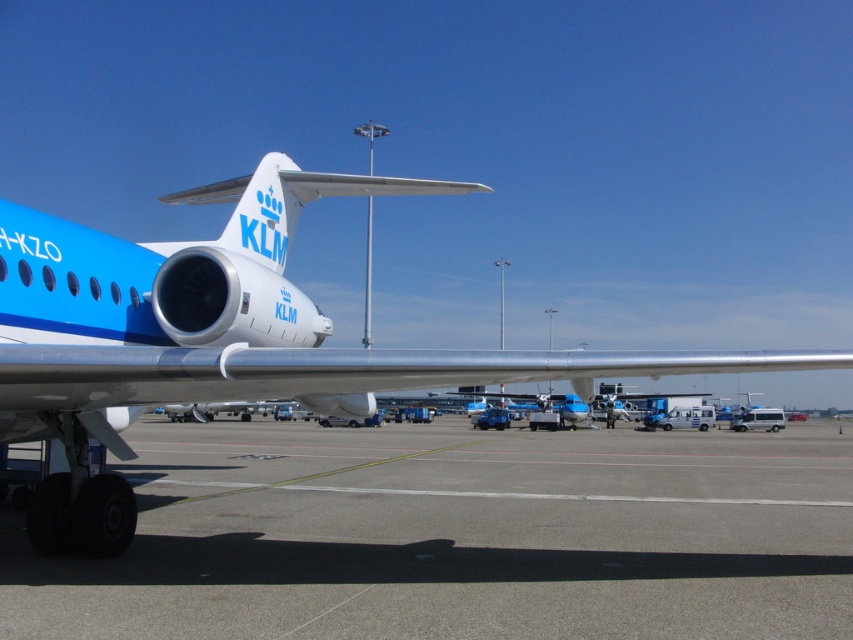
Can you confirm if gray concrete runway at center is positioned above matte blue airplane at center?

Actually, gray concrete runway at center is below matte blue airplane at center.

Can you confirm if gray concrete runway at center is thinner than matte blue airplane at center?

In fact, gray concrete runway at center might be wider than matte blue airplane at center.

The width and height of the screenshot is (853, 640). Identify the location of gray concrete runway at center. (459, 536).